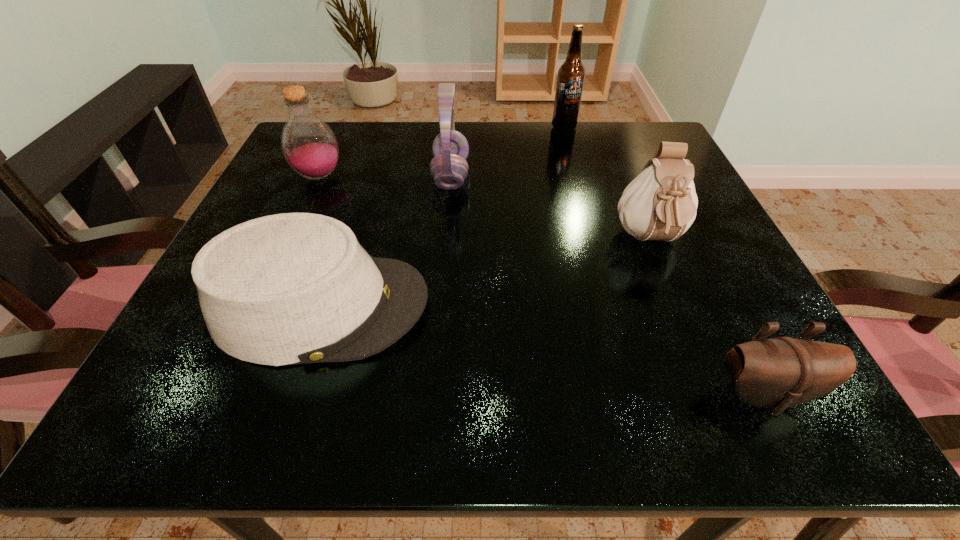
Image resolution: width=960 pixels, height=540 pixels. Identify the location of the third object from right to left. tap(570, 80).

Image resolution: width=960 pixels, height=540 pixels. I want to click on the tallest object, so click(x=570, y=80).

Find the location of a particular element. headset is located at coordinates (449, 168).

Image resolution: width=960 pixels, height=540 pixels. I want to click on bottle, so click(x=310, y=147).

In order to click on the farther pouch in this screenshot , I will do coord(660,203).

Locate an element on the screen. hat is located at coordinates (294, 288).

Image resolution: width=960 pixels, height=540 pixels. Identify the location of the nearer pouch. (x=779, y=373).

Image resolution: width=960 pixels, height=540 pixels. What are the coordinates of `the nearest object` in the screenshot? It's located at (x=779, y=373).

The width and height of the screenshot is (960, 540). I want to click on vacant space situated 0.120m on the label of the beer bottle, so click(x=573, y=159).

You are a GUI agent. You are given a task and a screenshot of the screen. Output one action in this format:
    pyautogui.click(x=<x>, y=<y>)
    Task: Click on the vacant space situated on the headband and ear cups of the headset
    
    Given the screenshot: What is the action you would take?
    pyautogui.click(x=552, y=176)